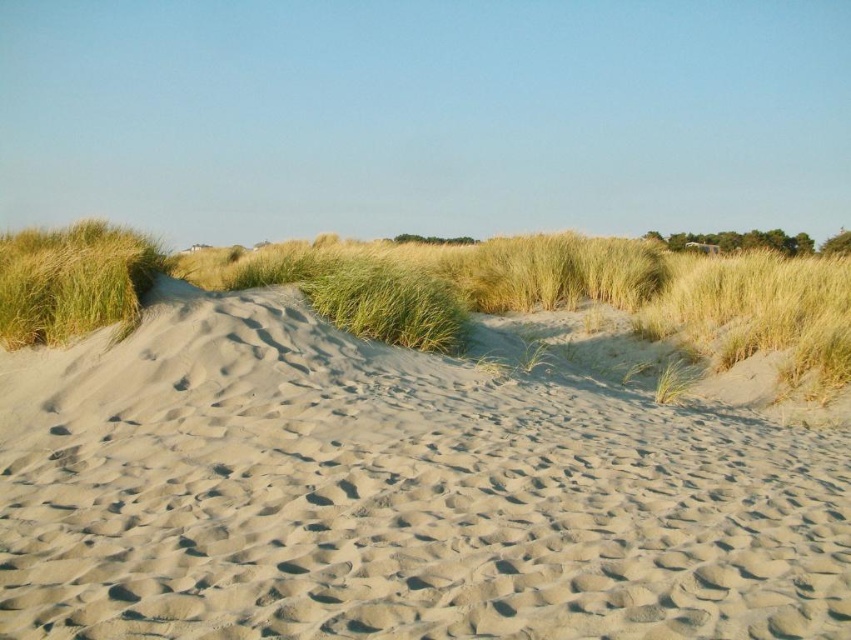
Which of these two, smooth sand at center or green grass at center, stands shorter?

smooth sand at center is shorter.

Which is above, smooth sand at center or green grass at center?

green grass at center is above.

Locate an element on the screen. The width and height of the screenshot is (851, 640). smooth sand at center is located at coordinates click(391, 496).

Is point (317, 260) positioned behind point (104, 300)?

Yes, it is.

Describe the element at coordinates (455, 291) in the screenshot. The height and width of the screenshot is (640, 851). I see `green grass at center` at that location.

Locate an element on the screen. The image size is (851, 640). green grass at center is located at coordinates (455, 291).

Where is `green grass at center`? green grass at center is located at coordinates (455, 291).

Is smooth sand at center closer to camera compared to green grassy at left?

Yes, it is in front of green grassy at left.

Which is more to the right, smooth sand at center or green grassy at left?

smooth sand at center is more to the right.

What do you see at coordinates (391, 496) in the screenshot?
I see `smooth sand at center` at bounding box center [391, 496].

At what (x,y) coordinates should I click in order to perform the action: click on smooth sand at center. Please return your answer as a coordinate pair (x, y). Image resolution: width=851 pixels, height=640 pixels. Looking at the image, I should click on (391, 496).